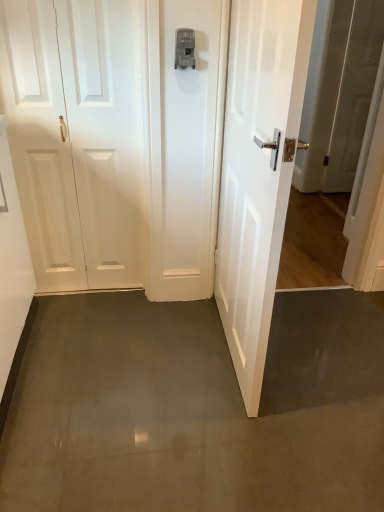
Question: Would you say white glossy door at left, the second door from the right, is outside matte gray latch at center?

Choices:
 (A) no
 (B) yes

Answer: (B)

Question: Considering the relative sizes of white glossy door at left, the 1th door positioned from the left, and matte gray latch at center in the image provided, is white glossy door at left, the 1th door positioned from the left, thinner than matte gray latch at center?

Choices:
 (A) no
 (B) yes

Answer: (B)

Question: Considering the relative sizes of white glossy door at left, the 1th door positioned from the left, and matte gray latch at center in the image provided, is white glossy door at left, the 1th door positioned from the left, wider than matte gray latch at center?

Choices:
 (A) no
 (B) yes

Answer: (A)

Question: From the image's perspective, is white glossy door at left, the 1th door positioned from the left, located above matte gray latch at center?

Choices:
 (A) yes
 (B) no

Answer: (B)

Question: Is white glossy door at left, the 1th door positioned from the left, beside matte gray latch at center?

Choices:
 (A) no
 (B) yes

Answer: (A)

Question: From a real-world perspective, is white glossy door at left, the second door from the right, physically above matte gray latch at center?

Choices:
 (A) yes
 (B) no

Answer: (B)

Question: Is white glossy door at right, the 2th door in the left-to-right sequence, looking in the opposite direction of white glossy door at left, the 1th door positioned from the left?

Choices:
 (A) yes
 (B) no

Answer: (A)

Question: Can you confirm if white glossy door at right, which appears as the first door when viewed from the right, is thinner than white glossy door at left, the 1th door positioned from the left?

Choices:
 (A) no
 (B) yes

Answer: (A)

Question: Can you confirm if white glossy door at right, the 2th door in the left-to-right sequence, is positioned to the right of white glossy door at left, the 1th door positioned from the left?

Choices:
 (A) no
 (B) yes

Answer: (B)

Question: From the image's perspective, is white glossy door at right, which appears as the first door when viewed from the right, on white glossy door at left, the second door from the right?

Choices:
 (A) no
 (B) yes

Answer: (A)

Question: Is white glossy door at right, which appears as the first door when viewed from the right, facing towards white glossy door at left, the 1th door positioned from the left?

Choices:
 (A) yes
 (B) no

Answer: (B)

Question: Can you confirm if white glossy door at right, the 2th door in the left-to-right sequence, is wider than white glossy door at left, the second door from the right?

Choices:
 (A) yes
 (B) no

Answer: (A)

Question: From the image's perspective, is matte gray latch at center over white glossy door at right, which appears as the first door when viewed from the right?

Choices:
 (A) yes
 (B) no

Answer: (A)